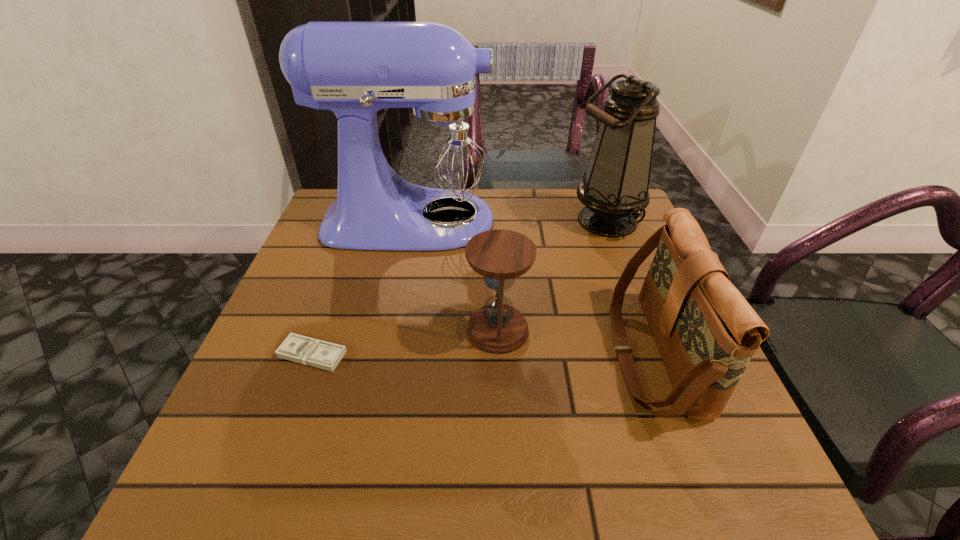
In the image, there is a desktop. Where is `blank space at the near edge`? The height and width of the screenshot is (540, 960). blank space at the near edge is located at coordinates (524, 475).

You are a GUI agent. You are given a task and a screenshot of the screen. Output one action in this format:
    pyautogui.click(x=<x>, y=<y>)
    Task: Click on the vacant space at the left edge
    
    Given the screenshot: What is the action you would take?
    pyautogui.click(x=325, y=258)

You are a GUI agent. You are given a task and a screenshot of the screen. Output one action in this format:
    pyautogui.click(x=<x>, y=<y>)
    Task: Click on the free space at the right edge
    Image resolution: width=960 pixels, height=540 pixels.
    Given the screenshot: What is the action you would take?
    pyautogui.click(x=620, y=242)

I want to click on free location at the near left corner, so click(x=253, y=491).

In the image, there is a desktop. At what (x,y) coordinates should I click in order to perform the action: click on vacant space at the near right corner. Please return your answer as a coordinate pair (x, y). This screenshot has width=960, height=540. Looking at the image, I should click on (742, 486).

Locate an element on the screen. This screenshot has width=960, height=540. vacant region between the shortest object and the hourglass is located at coordinates (405, 342).

At what (x,y) coordinates should I click in order to perform the action: click on free space between the oil lamp and the tallest object. Please return your answer as a coordinate pair (x, y). The height and width of the screenshot is (540, 960). Looking at the image, I should click on (511, 220).

Find the location of `free space between the hourglass and the second tallest object`. free space between the hourglass and the second tallest object is located at coordinates (552, 275).

Image resolution: width=960 pixels, height=540 pixels. Identify the location of empty space between the shortest object and the second shortest object. (405, 342).

You are a GUI agent. You are given a task and a screenshot of the screen. Output one action in this format:
    pyautogui.click(x=<x>, y=<y>)
    Task: Click on the empty space between the shoulder bag and the fourth shortest object
    The height and width of the screenshot is (540, 960).
    Given the screenshot: What is the action you would take?
    pyautogui.click(x=629, y=287)